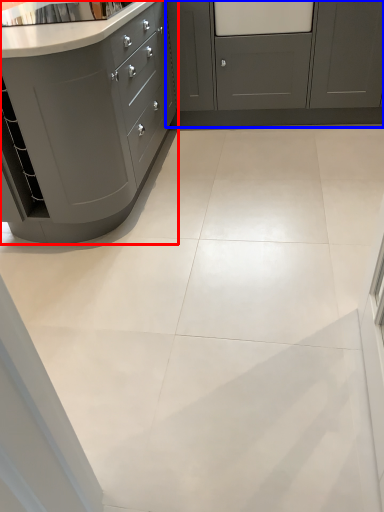
Question: Among these objects, which one is nearest to the camera, cabinetry (highlighted by a red box) or cabinetry (highlighted by a blue box)?

Choices:
 (A) cabinetry
 (B) cabinetry

Answer: (A)